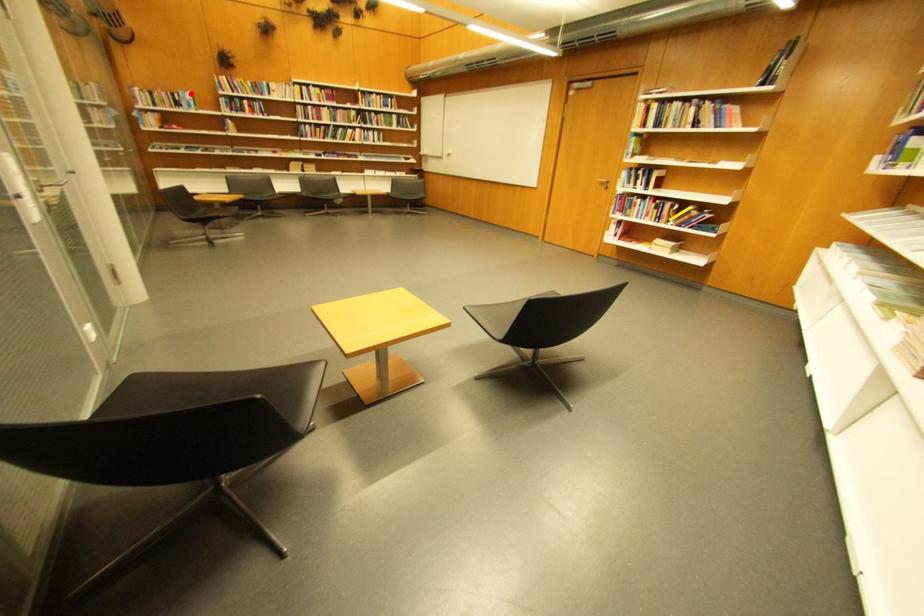
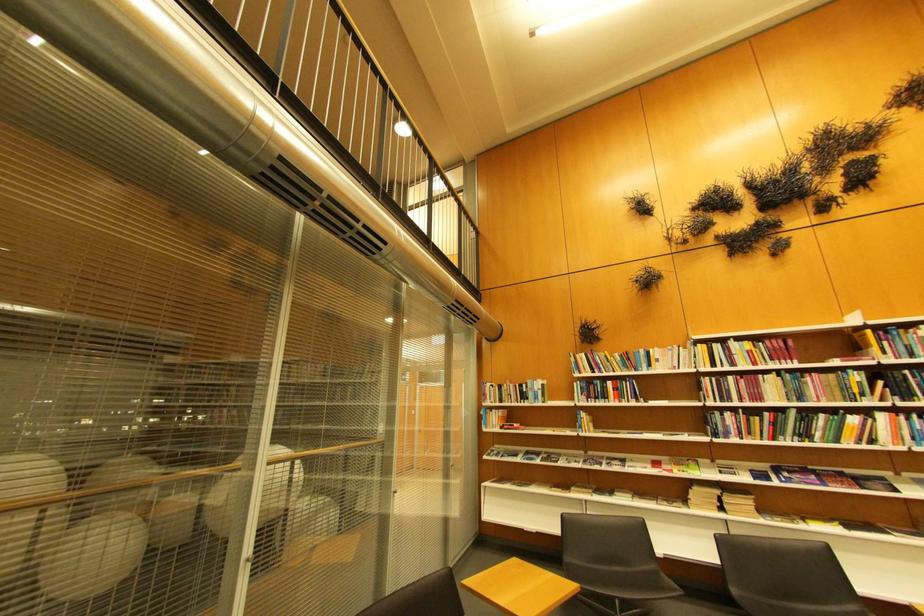
Where in the second image is the point corresponding to the highlighted location from the first image?

(540, 383)